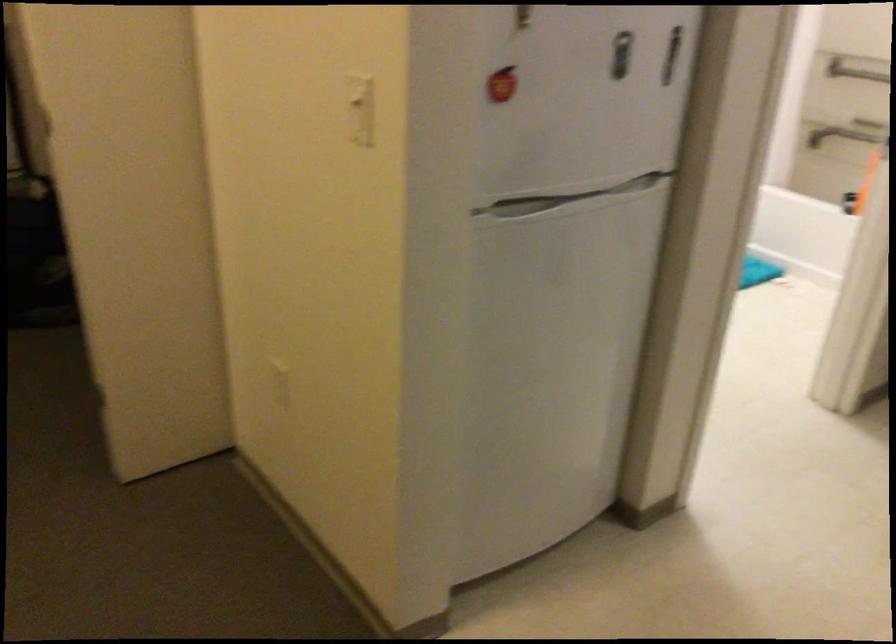
The height and width of the screenshot is (644, 896). What are the coordinates of `white light switch` in the screenshot? It's located at (358, 108).